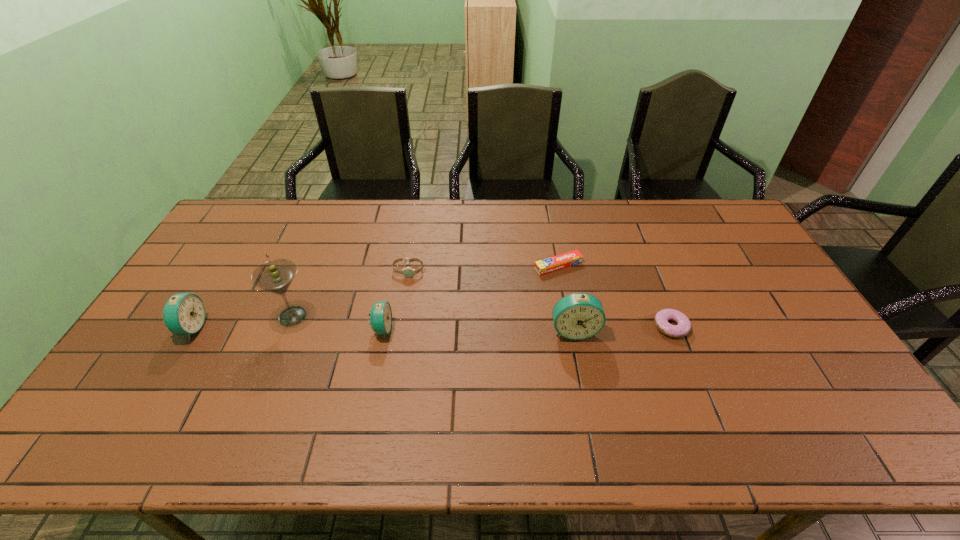
Where is `the leftmost alarm clock`? Image resolution: width=960 pixels, height=540 pixels. the leftmost alarm clock is located at coordinates (184, 313).

This screenshot has width=960, height=540. In order to click on the fifth shortest object in this screenshot , I will do (184, 313).

This screenshot has width=960, height=540. What are the coordinates of `the shortest alarm clock` in the screenshot? It's located at (380, 315).

Where is `the fourth tallest object`? The image size is (960, 540). the fourth tallest object is located at coordinates (380, 315).

Where is `the tallest alarm clock`? the tallest alarm clock is located at coordinates (577, 316).

You are a GUI agent. You are given a task and a screenshot of the screen. Output one action in this format:
    pyautogui.click(x=<x>, y=<y>)
    Task: Click on the sixth shortest object
    The width and height of the screenshot is (960, 540).
    Given the screenshot: What is the action you would take?
    pyautogui.click(x=577, y=316)

You are a GUI agent. You are given a task and a screenshot of the screen. Output one action in this format:
    pyautogui.click(x=<x>, y=<y>)
    Task: Click on the second object from left to right
    
    Given the screenshot: What is the action you would take?
    pyautogui.click(x=275, y=276)

This screenshot has width=960, height=540. Find the location of `martini`. martini is located at coordinates (275, 276).

Find the location of a particular element. This screenshot has width=960, height=540. watch is located at coordinates (407, 272).

The width and height of the screenshot is (960, 540). Identify the location of toothpaste. (574, 257).